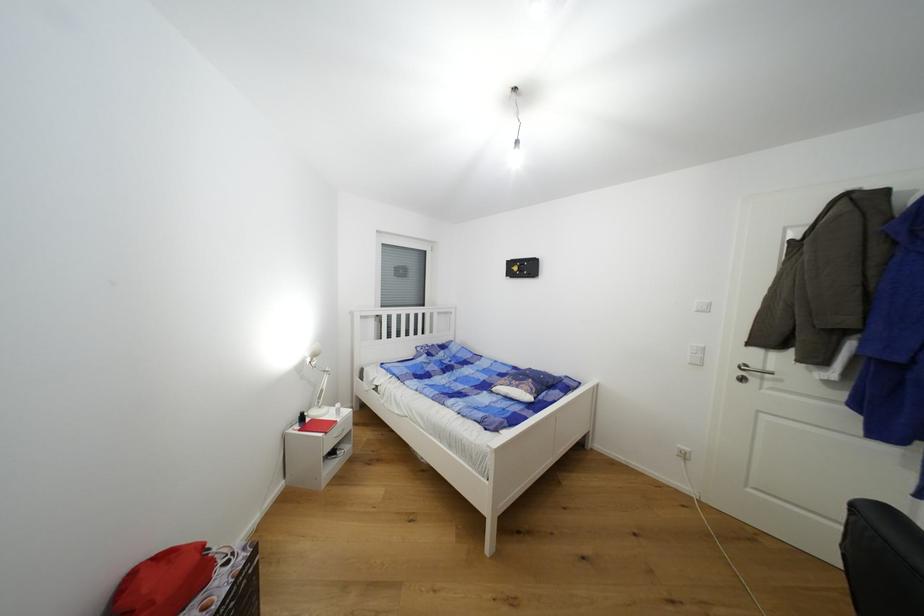
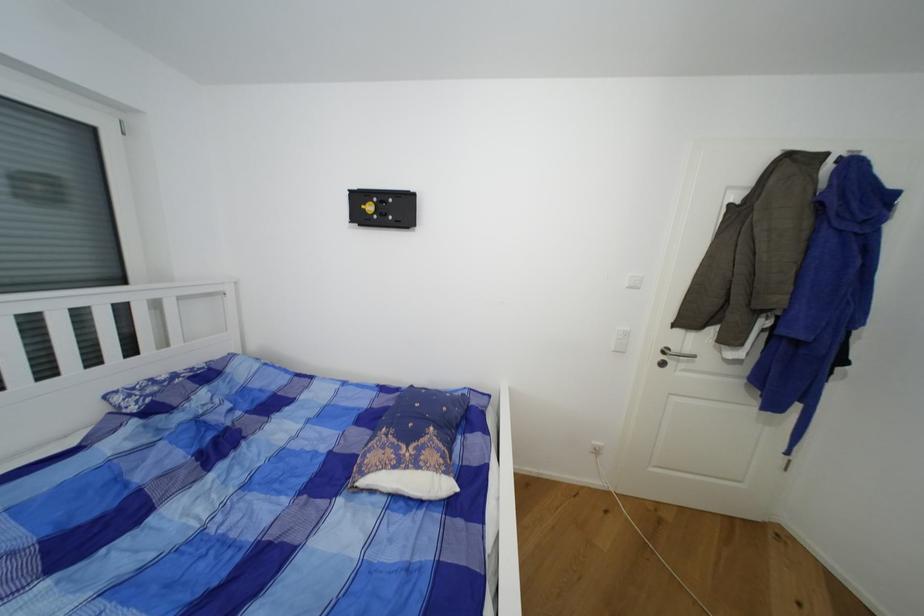
Locate, in the second image, the point that corresponds to (535,400) in the first image.

(454, 488)